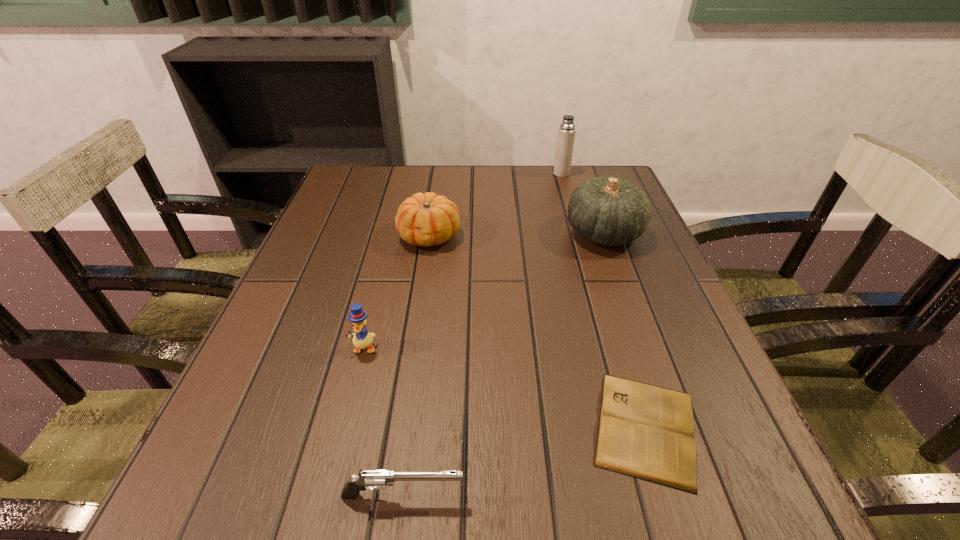
Identify the location of free spot located on the front-facing side of the pistol. This screenshot has width=960, height=540. (546, 495).

Locate an element on the screen. This screenshot has height=540, width=960. free space located 0.160m on the back of the shortest object is located at coordinates (608, 307).

Find the location of a particular element. Image resolution: width=960 pixels, height=540 pixels. object present at the far edge is located at coordinates (566, 132).

Find the location of a particular element. The width and height of the screenshot is (960, 540). pistol that is at the near edge is located at coordinates (371, 479).

Find the location of a particular element. book that is at the near edge is located at coordinates (645, 431).

The height and width of the screenshot is (540, 960). Identify the location of thermos bottle that is at the right edge. (566, 132).

I want to click on gourd present at the right edge, so click(x=609, y=211).

At what (x,y) coordinates should I click in order to perform the action: click on book situated at the right edge. Please return your answer as a coordinate pair (x, y). The height and width of the screenshot is (540, 960). Looking at the image, I should click on (645, 431).

Identify the location of object that is positioned at the far right corner. (566, 132).

This screenshot has width=960, height=540. Find the location of `object positioned at the near right corner`. object positioned at the near right corner is located at coordinates (645, 431).